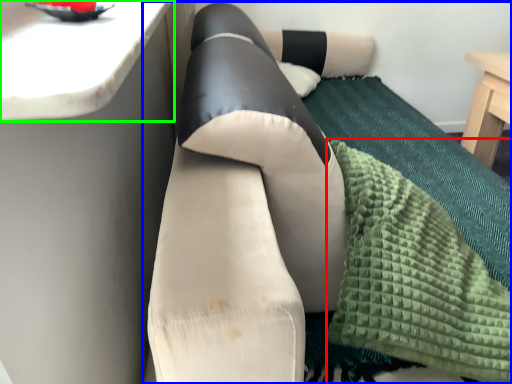
Question: Which object is the closest to the blanket (highlighted by a red box)? Choose among these: studio couch (highlighted by a blue box) or counter top (highlighted by a green box).

Choices:
 (A) studio couch
 (B) counter top

Answer: (A)